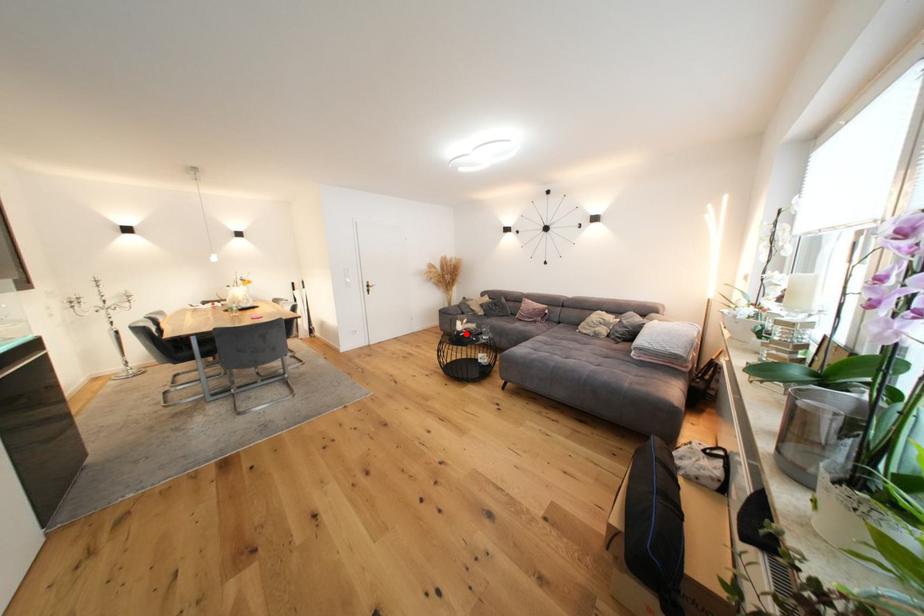
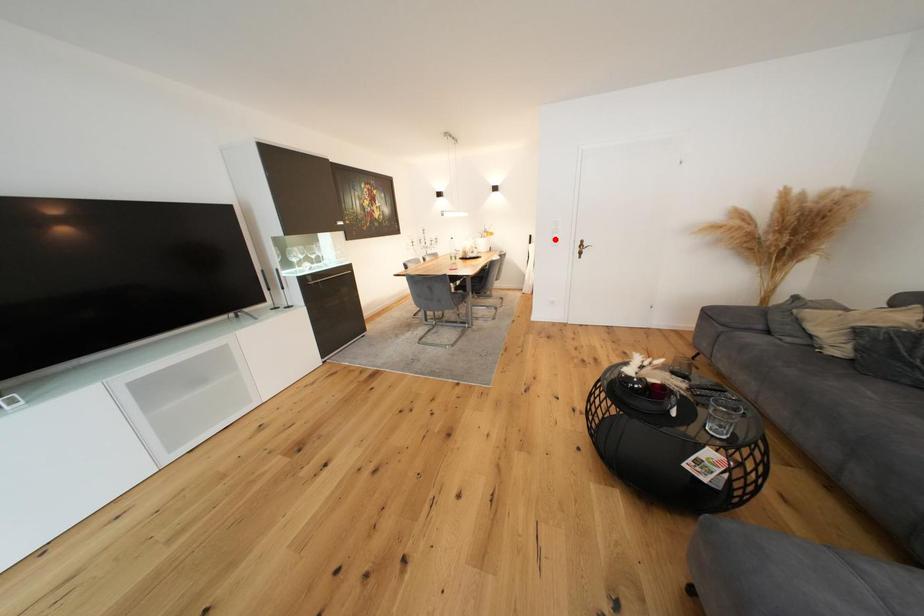
I am providing you with two images of the same scene from different viewpoints. A red point is marked on the first image and another point is marked on the second image. Do the highlighted points in image1 and image2 indicate the same real-world spot?

No